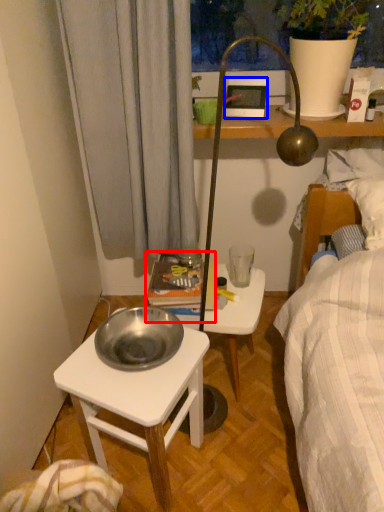
Question: Which of the following is the closest to the observer, book (highlighted by a red box) or picture frame (highlighted by a blue box)?

Choices:
 (A) book
 (B) picture frame

Answer: (A)